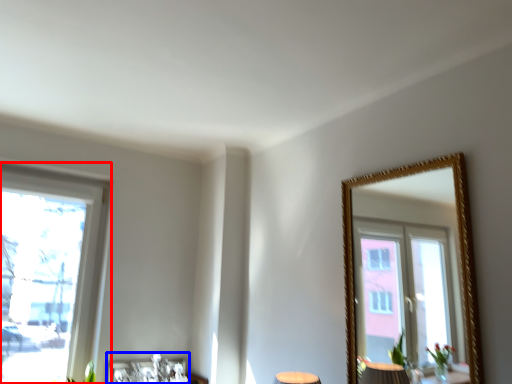
Question: Which of the following is the farthest to the observer, window (highlighted by a red box) or picture frame (highlighted by a blue box)?

Choices:
 (A) window
 (B) picture frame

Answer: (B)